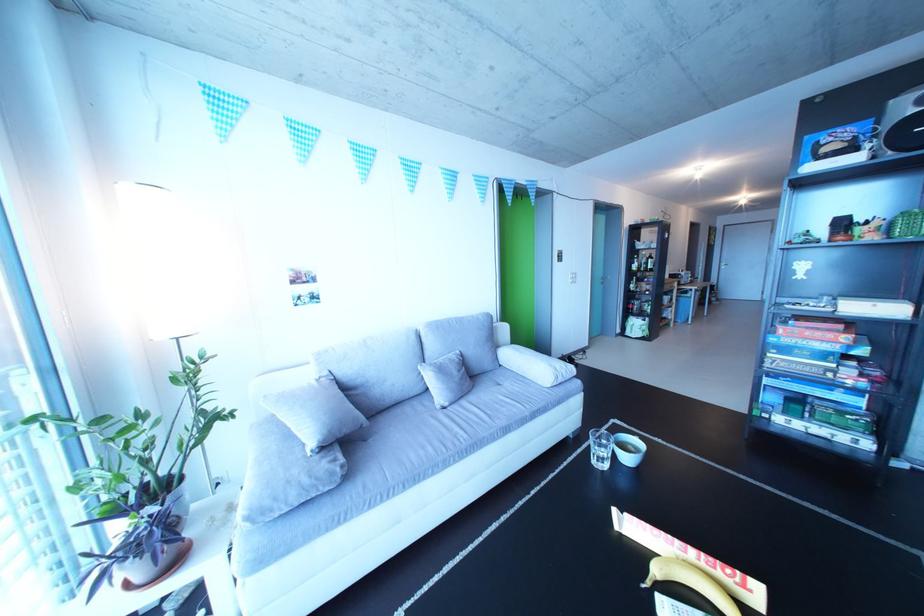
You are a GUI agent. You are given a task and a screenshot of the screen. Output one action in this format:
    pyautogui.click(x=<x>, y=<y>)
    Task: Click on the silver plant pot
    The width and height of the screenshot is (924, 616).
    Given the screenshot: What is the action you would take?
    pyautogui.click(x=152, y=545)